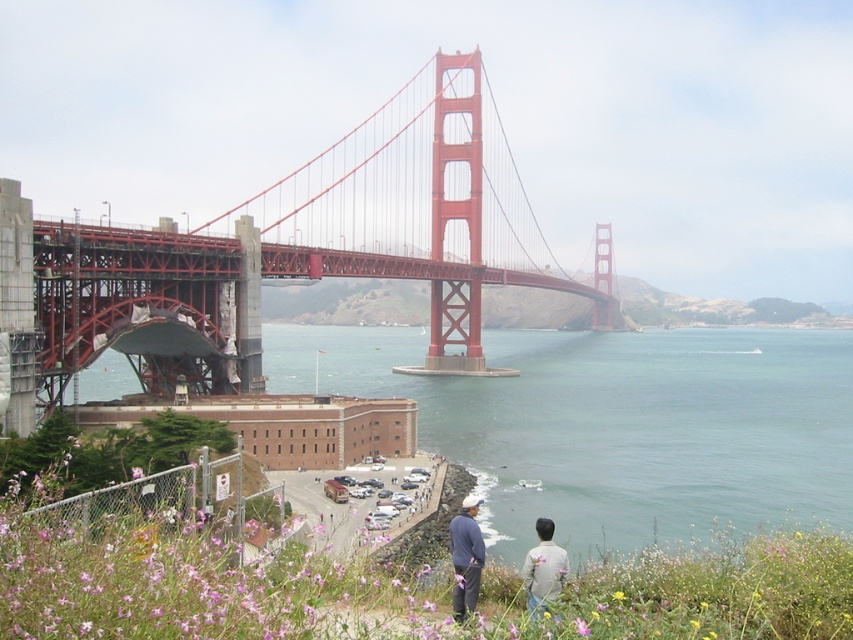
Consider the image. Which is more to the right, red steel suspension bridge at center or matte gray hoodie at lower center?

matte gray hoodie at lower center

Is point (199, 241) less distant than point (532, 576)?

No, (199, 241) is further to viewer.

Between point (422, 131) and point (467, 499), which one is positioned in front?

Point (467, 499) is in front.

Find the location of a particular element. red steel suspension bridge at center is located at coordinates point(312,248).

Is matte gray hoodie at lower center wider than gray cotton shirt at lower right?

Yes, matte gray hoodie at lower center is wider than gray cotton shirt at lower right.

Can you confirm if matte gray hoodie at lower center is positioned to the left of gray cotton shirt at lower right?

Correct, you'll find matte gray hoodie at lower center to the left of gray cotton shirt at lower right.

I want to click on matte gray hoodie at lower center, so click(x=466, y=557).

Who is more forward, (469, 547) or (532, 548)?

Positioned in front is point (469, 547).

Where is `gray fabric pants at center`? The width and height of the screenshot is (853, 640). gray fabric pants at center is located at coordinates (466, 557).